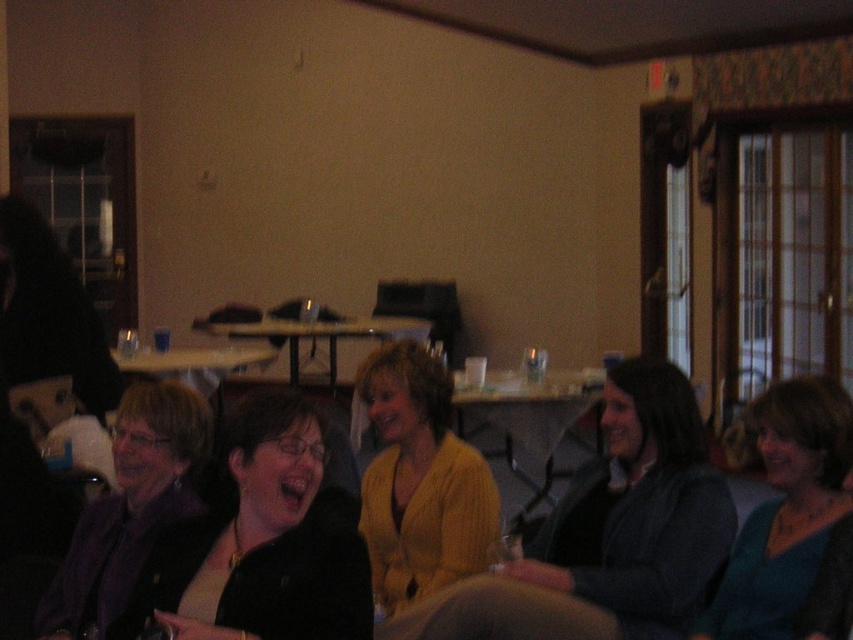
Between black matte glasses at center and yellow knitted sweater at center, which one is positioned higher?

yellow knitted sweater at center

Between black matte glasses at center and yellow knitted sweater at center, which one has less height?

Standing shorter between the two is black matte glasses at center.

Is point (225, 564) positioned after point (473, 483)?

That is False.

This screenshot has height=640, width=853. Identify the location of black matte glasses at center. (265, 541).

Consider the image. Can you confirm if teal matte sweater at center is wider than purple fabric jacket at lower left?

Yes.

Between point (799, 522) and point (172, 438), which one is positioned in front?

Point (799, 522) is in front.

Find the location of a particular element. teal matte sweater at center is located at coordinates (786, 509).

Does point (749, 573) come in front of point (253, 348)?

Yes.

Is teal matte sweater at center above wooden table at center?

No.

Measure the distance between point [805,445] and camera.

The distance of point [805,445] from camera is 7.48 feet.

This screenshot has width=853, height=640. Find the location of `teal matte sweater at center`. teal matte sweater at center is located at coordinates (786, 509).